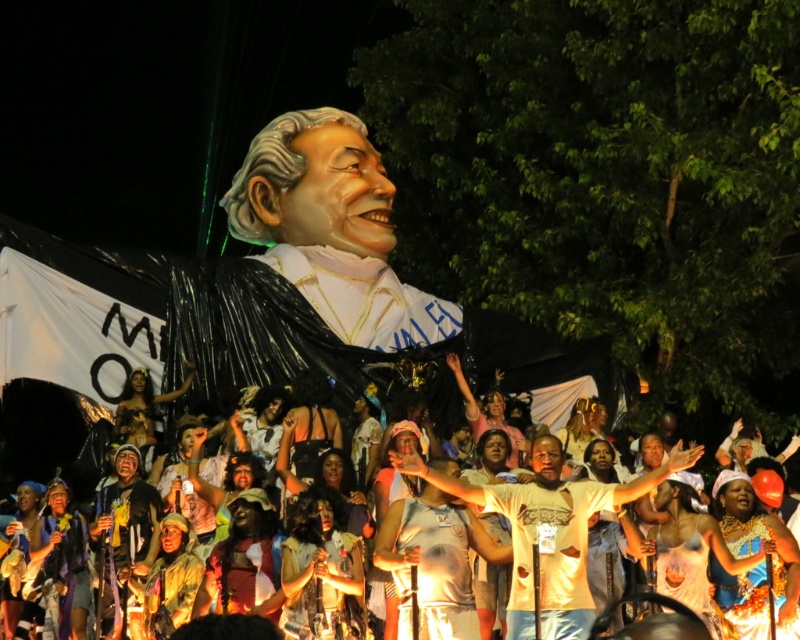
Question: Is white t-shirt at center bigger than white matte statue at center?

Choices:
 (A) yes
 (B) no

Answer: (B)

Question: Is white t-shirt at center wider than white matte statue at center?

Choices:
 (A) yes
 (B) no

Answer: (B)

Question: Which point is farther from the camera taking this photo?

Choices:
 (A) (642, 486)
 (B) (356, 404)

Answer: (B)

Question: Is white t-shirt at center further to the viewer compared to white matte statue at center?

Choices:
 (A) yes
 (B) no

Answer: (B)

Question: Which object is closer to the camera taking this photo?

Choices:
 (A) white t-shirt at center
 (B) white matte statue at center

Answer: (A)